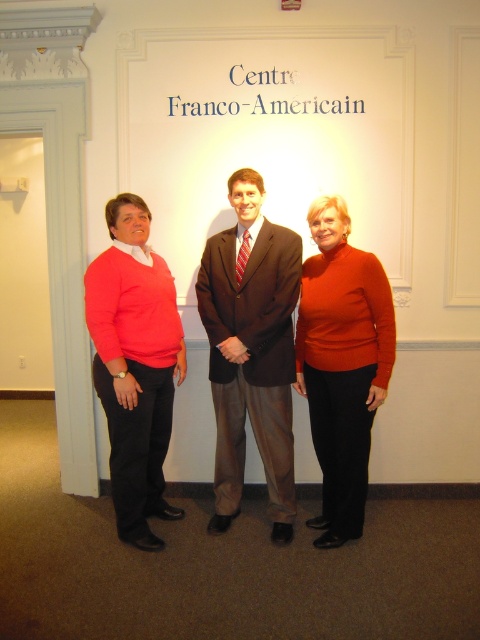
Question: Is matte coral sweater at left smaller than matte orange sweater at center?

Choices:
 (A) no
 (B) yes

Answer: (A)

Question: Which object is positioned closest to the matte brown suit at center?

Choices:
 (A) matte orange sweater at center
 (B) matte coral sweater at left

Answer: (A)

Question: Does matte coral sweater at left have a smaller size compared to matte orange sweater at center?

Choices:
 (A) yes
 (B) no

Answer: (B)

Question: Among these points, which one is nearest to the camera?

Choices:
 (A) (220, 531)
 (B) (331, 308)
 (C) (134, 204)

Answer: (B)

Question: Is matte brown suit at center in front of matte orange sweater at center?

Choices:
 (A) yes
 (B) no

Answer: (B)

Question: Which object is the closest to the matte brown suit at center?

Choices:
 (A) matte orange sweater at center
 (B) matte coral sweater at left

Answer: (A)